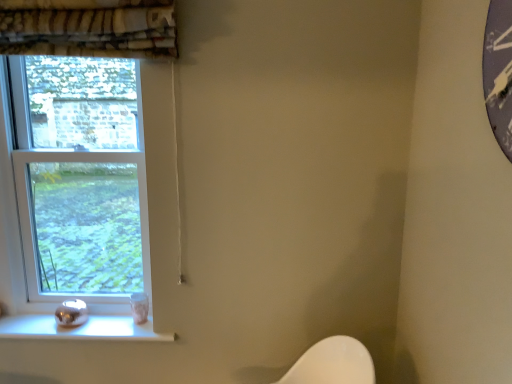
Image resolution: width=512 pixels, height=384 pixels. Identify the location of metallic silver bowl at lower left. (80, 329).

What is the approximate width of metallic silver bowl at lower left?

It is 6.89 inches.

Describe the element at coordinates (80, 329) in the screenshot. I see `metallic silver bowl at lower left` at that location.

The height and width of the screenshot is (384, 512). I want to click on metallic silver bowl at lower left, so click(x=80, y=329).